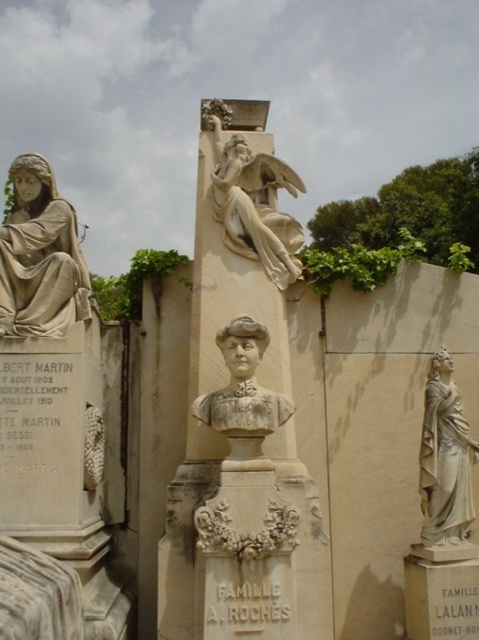
You are standing at the entrance of the cemetery and want to place a bouquet of flowers directly in front of the white stone column at center. However, there is an existing matte stone bust at center in the way. Can you place the bouquet in front of the column without moving the bust?

The white stone column at center is positioned over the matte stone bust at center, meaning the column is above the bust. Therefore, you can place the bouquet in front of the column without moving the bust since they are vertically aligned, and the bust does not block the front area of the column.

You are standing in the cemetery scene. You see a point marked at coordinates (40,257). What object is located at this point?

The point at coordinates (40,257) indicates the matte stone statue at left.